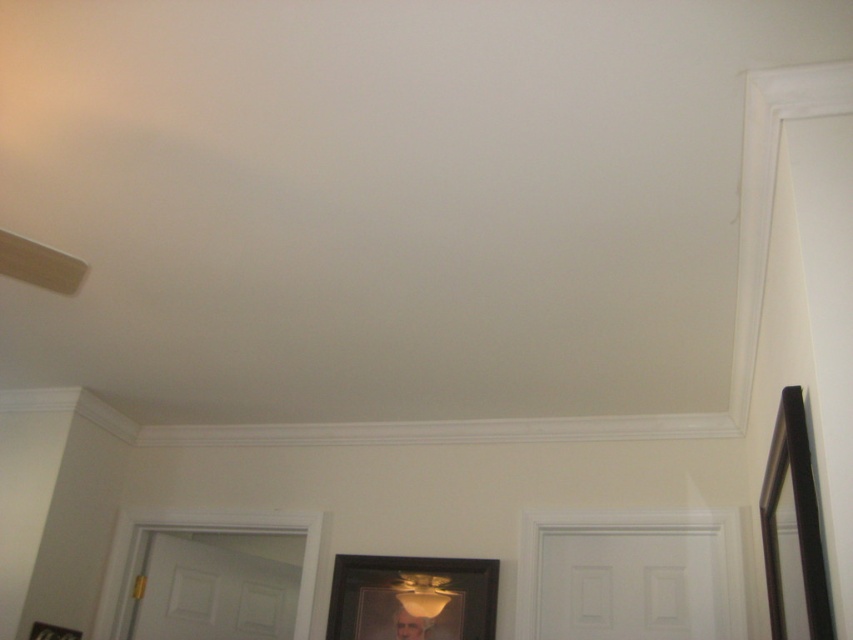
You are hanging two artworks in this room. You have a black matte picture frame at center and a smooth gold portrait at center. According to the scene, which one is placed higher on the wall?

The black matte picture frame at center is placed higher because it is above the smooth gold portrait at center.

Based on the photo, you are hanging two items on the wall in the room described. The black matte picture frame at right is taller than the smooth gold portrait at center. Which object should you place higher on the wall to ensure proper balance?

The black matte picture frame at right should be placed higher on the wall since it has a greater height compared to the smooth gold portrait at center, ensuring visual balance by aligning their top edges.

You are standing in the room and want to hang a new picture between the matte yellow lampshade at center and the smooth gold portrait at center. Since both are at the center, which one is closer to you so you can decide where to place the new picture?

The matte yellow lampshade at center is closer to you than the smooth gold portrait at center, so you should place the new picture between them behind the matte yellow lampshade at center.